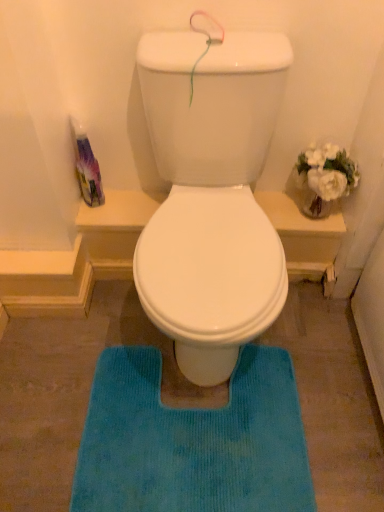
Question: Could you tell me if blue textured bath mat at center is turned towards translucent plastic bottle at left?

Choices:
 (A) yes
 (B) no

Answer: (B)

Question: Does blue textured bath mat at center have a lesser height compared to translucent plastic bottle at left?

Choices:
 (A) no
 (B) yes

Answer: (B)

Question: Is blue textured bath mat at center in contact with translucent plastic bottle at left?

Choices:
 (A) no
 (B) yes

Answer: (A)

Question: From the image's perspective, is blue textured bath mat at center on translucent plastic bottle at left?

Choices:
 (A) yes
 (B) no

Answer: (B)

Question: Is blue textured bath mat at center taller than translucent plastic bottle at left?

Choices:
 (A) yes
 (B) no

Answer: (B)

Question: Would you say translucent plastic bottle at left is part of blue textured bath mat at center's contents?

Choices:
 (A) yes
 (B) no

Answer: (B)

Question: From the image's perspective, is translucent plastic bottle at left under blue textured bath mat at center?

Choices:
 (A) yes
 (B) no

Answer: (B)

Question: Is translucent plastic bottle at left positioned before blue textured bath mat at center?

Choices:
 (A) no
 (B) yes

Answer: (A)

Question: Is translucent plastic bottle at left positioned behind blue textured bath mat at center?

Choices:
 (A) no
 (B) yes

Answer: (B)

Question: Is translucent plastic bottle at left oriented away from blue textured bath mat at center?

Choices:
 (A) no
 (B) yes

Answer: (A)

Question: From a real-world perspective, is translucent plastic bottle at left under blue textured bath mat at center?

Choices:
 (A) yes
 (B) no

Answer: (B)

Question: Does translucent plastic bottle at left have a lesser width compared to blue textured bath mat at center?

Choices:
 (A) no
 (B) yes

Answer: (B)

Question: In terms of size, does translucent plastic bottle at left appear bigger or smaller than blue textured bath mat at center?

Choices:
 (A) big
 (B) small

Answer: (B)